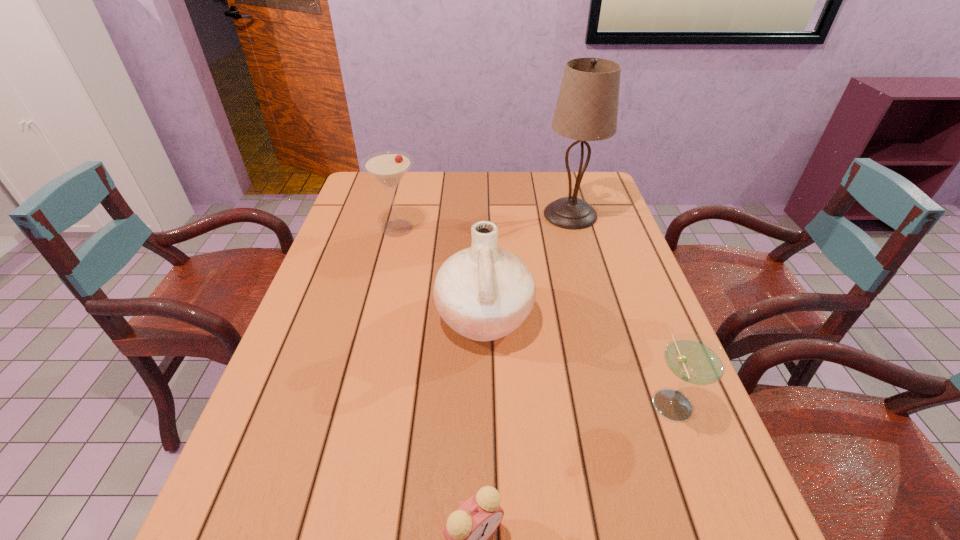
Locate an element on the screen. This screenshot has height=540, width=960. lampshade is located at coordinates (587, 107).

You are a GUI agent. You are given a task and a screenshot of the screen. Output one action in this format:
    pyautogui.click(x=<x>, y=<y>)
    Task: Click on the pottery
    This screenshot has width=960, height=540.
    Given the screenshot: What is the action you would take?
    [x=484, y=292]

Where is `the taller martini`? the taller martini is located at coordinates (388, 167).

Where is `the leftmost object`? This screenshot has width=960, height=540. the leftmost object is located at coordinates (388, 167).

At what (x,y) coordinates should I click in order to perform the action: click on the second nearest object. Please return your answer as a coordinate pair (x, y). This screenshot has width=960, height=540. Looking at the image, I should click on (694, 359).

Find the location of a particular element. The width and height of the screenshot is (960, 540). the right martini is located at coordinates (694, 359).

Find the location of a particular element. The height and width of the screenshot is (540, 960). free region located on the front-facing side of the tallest object is located at coordinates (495, 214).

Find the location of a particular element. This screenshot has width=960, height=540. vacant area situated 0.230m on the front-facing side of the tallest object is located at coordinates (470, 214).

Where is `blank space located on the front-facing side of the tallest object`? This screenshot has width=960, height=540. blank space located on the front-facing side of the tallest object is located at coordinates coord(487,214).

Identify the location of free spot located to pour from the handle of the pottery. (324, 318).